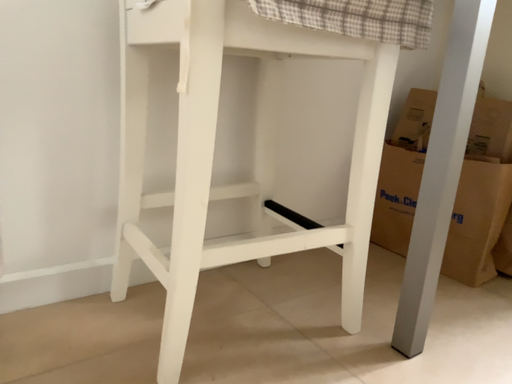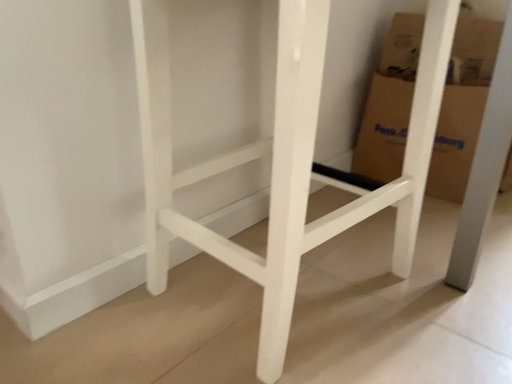
Question: Which way did the camera rotate in the video?

Choices:
 (A) rotated downward
 (B) rotated upward

Answer: (A)